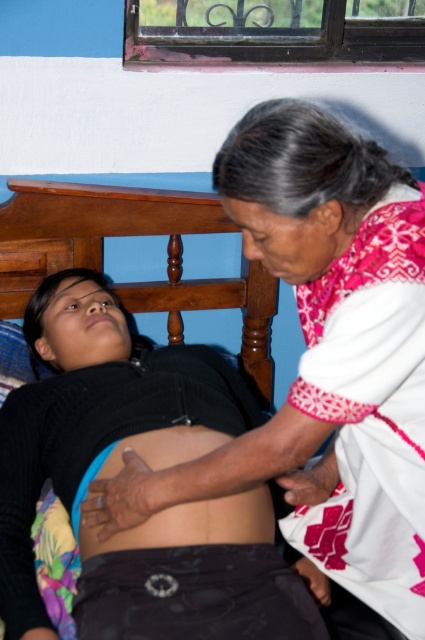
Question: Can you confirm if white embroidered blouse at upper right is bigger than smooth skin at center?

Choices:
 (A) no
 (B) yes

Answer: (B)

Question: Does matte black shirt at center appear on the right side of smooth skin at center?

Choices:
 (A) yes
 (B) no

Answer: (B)

Question: Which of the following is the closest to the observer?

Choices:
 (A) (178, 584)
 (B) (158, 456)

Answer: (A)

Question: Can you confirm if white embroidered blouse at upper right is positioned above matte black shirt at center?

Choices:
 (A) no
 (B) yes

Answer: (B)

Question: Which point is farther to the camera?

Choices:
 (A) white embroidered blouse at upper right
 (B) matte black shirt at center
 (C) smooth skin at center

Answer: (C)

Question: Which point appears closest to the camera in this image?

Choices:
 (A) (351, 301)
 (B) (238, 512)

Answer: (A)